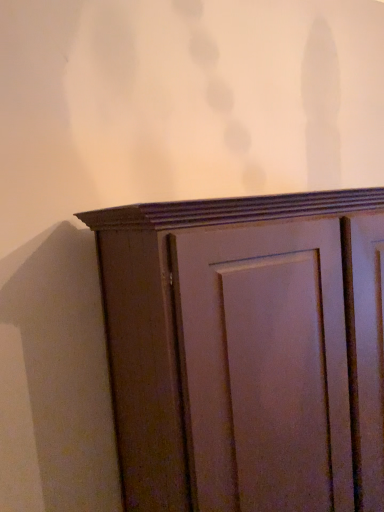
I want to click on matte wood cupboard at center, so click(x=247, y=351).

The height and width of the screenshot is (512, 384). What do you see at coordinates (247, 351) in the screenshot?
I see `matte wood cupboard at center` at bounding box center [247, 351].

This screenshot has width=384, height=512. Find the location of `matte wood cupboard at center`. matte wood cupboard at center is located at coordinates (247, 351).